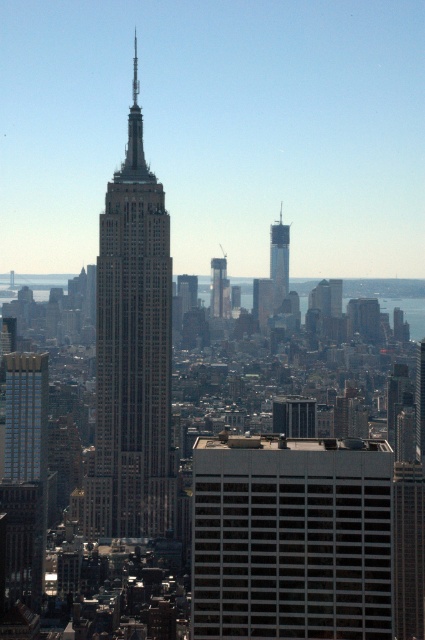
Is gray concrete building at center taller than brown stone tower at center?

Incorrect, gray concrete building at center's height is not larger of brown stone tower at center's.

Between gray concrete building at center and brown stone tower at center, which one is positioned higher?

brown stone tower at center is higher up.

The height and width of the screenshot is (640, 425). What do you see at coordinates (291, 540) in the screenshot?
I see `gray concrete building at center` at bounding box center [291, 540].

This screenshot has width=425, height=640. What are the coordinates of `gray concrete building at center` in the screenshot? It's located at (291, 540).

Measure the distance between brown stone tower at center and camera.

brown stone tower at center is 640.72 meters away from camera.

Is brown stone tower at center to the right of glassy steel skyscraper at center from the viewer's perspective?

In fact, brown stone tower at center is to the left of glassy steel skyscraper at center.

This screenshot has width=425, height=640. In order to click on brown stone tower at center in this screenshot , I will do `click(133, 353)`.

Is brown stone tower at center shorter than smooth glass skyscraper at center?

Incorrect, brown stone tower at center's height does not fall short of smooth glass skyscraper at center's.

Is brown stone tower at center to the left of smooth glass skyscraper at center from the viewer's perspective?

Yes, brown stone tower at center is to the left of smooth glass skyscraper at center.

Is point (127, 346) positioned in front of point (285, 248)?

Yes, it is in front of point (285, 248).

Locate an element on the screen. brown stone tower at center is located at coordinates (133, 353).